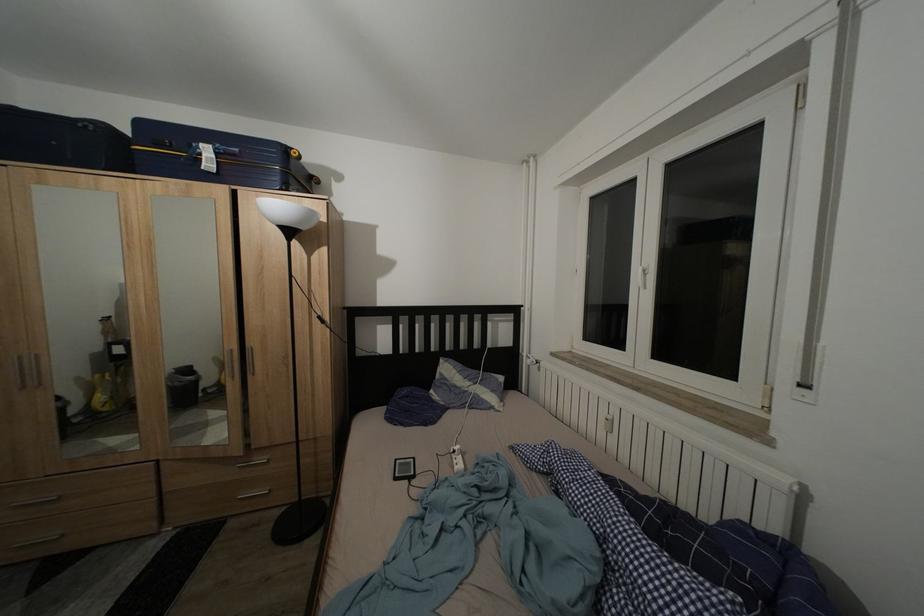
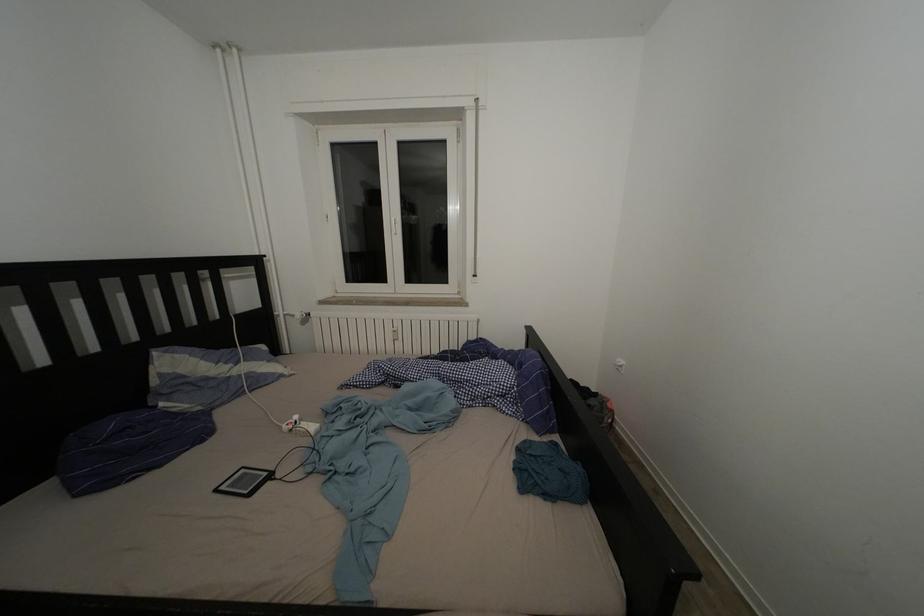
Question: Based on the continuous images, in which direction is the camera rotating? Reply with the corresponding letter.

Choices:
 (A) Left
 (B) Right
 (C) Up
 (D) Down

Answer: (B)